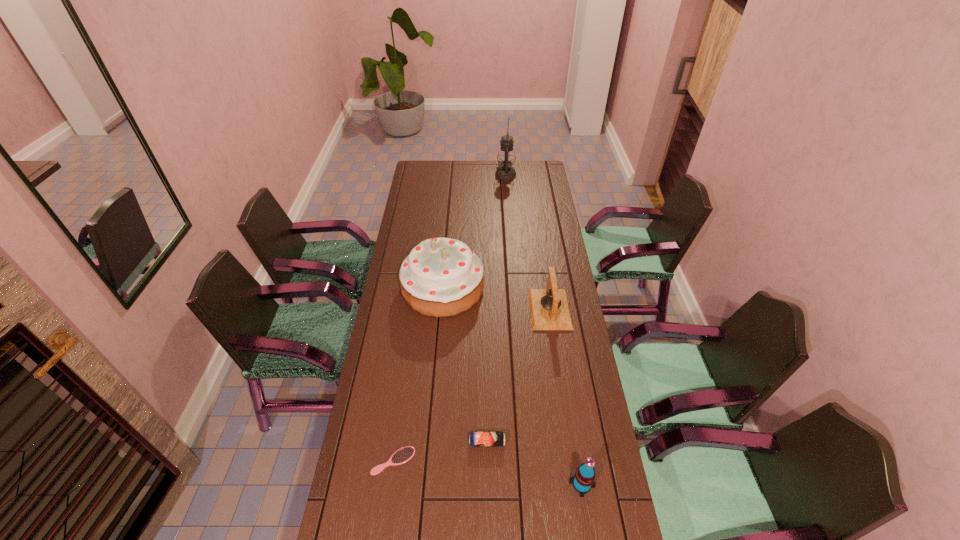
Find the location of a particular element. Image resolution: width=960 pixels, height=540 pixels. the tallest object is located at coordinates (506, 157).

The image size is (960, 540). What are the coordinates of `oil lamp` in the screenshot? It's located at (506, 157).

Image resolution: width=960 pixels, height=540 pixels. Identify the location of cake. (441, 277).

The width and height of the screenshot is (960, 540). I want to click on bell, so click(x=549, y=309).

In order to click on soda in this screenshot , I will do `click(584, 479)`.

The height and width of the screenshot is (540, 960). Identify the location of the second shortest object. (476, 439).

Locate an element on the screen. The image size is (960, 540). the shortest object is located at coordinates (404, 454).

Find the location of a particular element. This screenshot has height=540, width=960. free space located 0.100m on the left of the tallest object is located at coordinates (477, 175).

The image size is (960, 540). I want to click on free space located 0.370m on the front of the second tallest object, so click(433, 407).

Find the location of a particular element. vacant space situated 0.240m on the left of the bell is located at coordinates (468, 309).